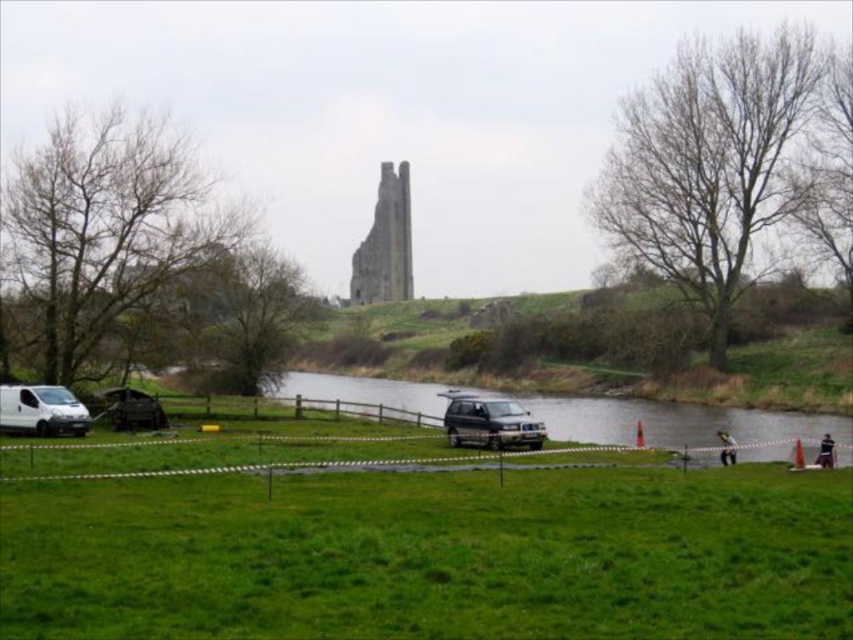
Question: Among these objects, which one is farthest from the camera?

Choices:
 (A) green grassy river at center
 (B) satin silver suv at center

Answer: (B)

Question: Which of the following is the closest to the observer?

Choices:
 (A) (20, 417)
 (B) (103, 396)
 (C) (734, 429)

Answer: (A)

Question: Is the position of green grassy river at center more distant than that of metallic dark gray suv at lower left?

Choices:
 (A) yes
 (B) no

Answer: (B)

Question: Is green grassy river at center in front of satin silver suv at center?

Choices:
 (A) yes
 (B) no

Answer: (A)

Question: Is green grass at center smaller than white matte van at lower left?

Choices:
 (A) yes
 (B) no

Answer: (B)

Question: Based on their relative distances, which object is farther from the green grass at center?

Choices:
 (A) metallic dark gray suv at lower left
 (B) green grassy river at center
 (C) white matte van at lower left
 (D) satin silver suv at center

Answer: (A)